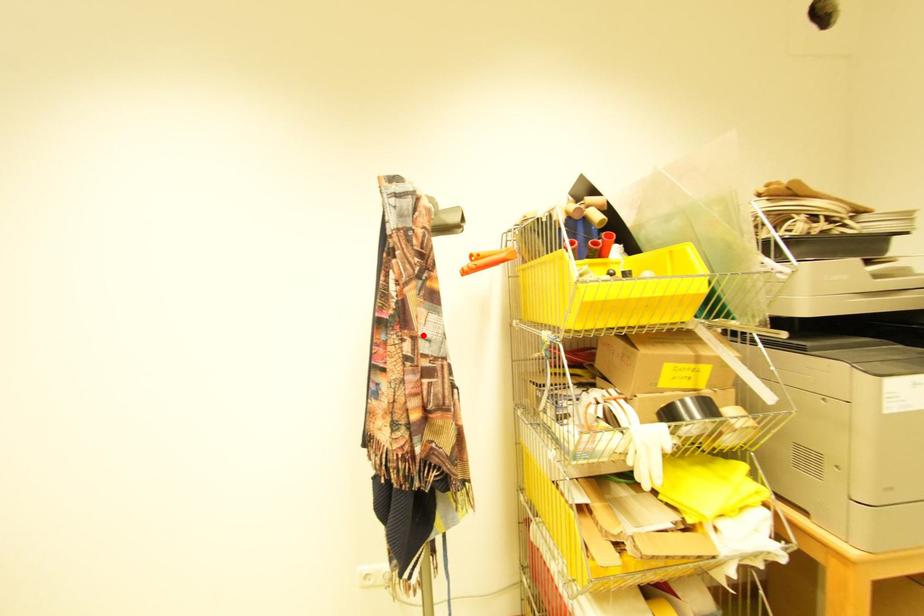
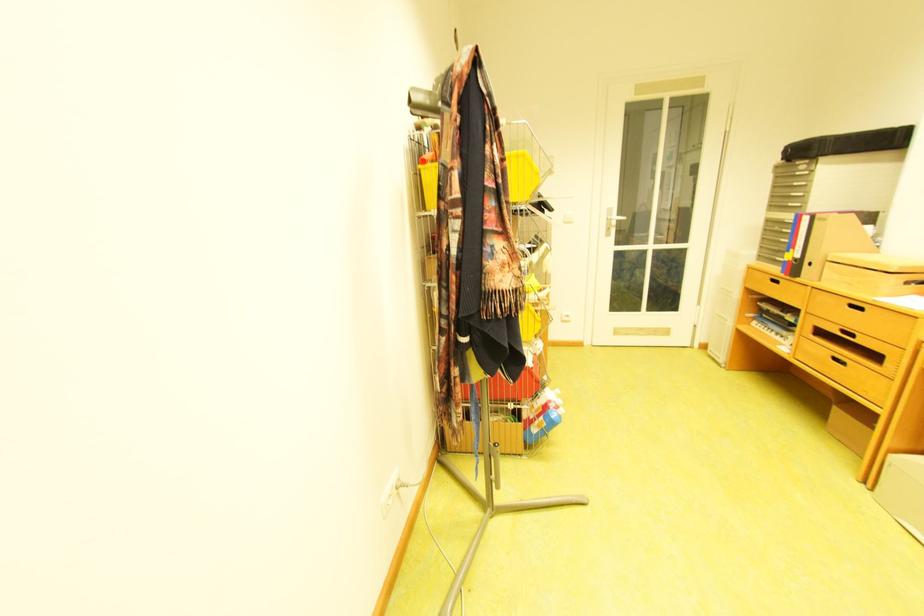
In the second image, find the point that corresponds to the highlighted location in the first image.

(518, 201)